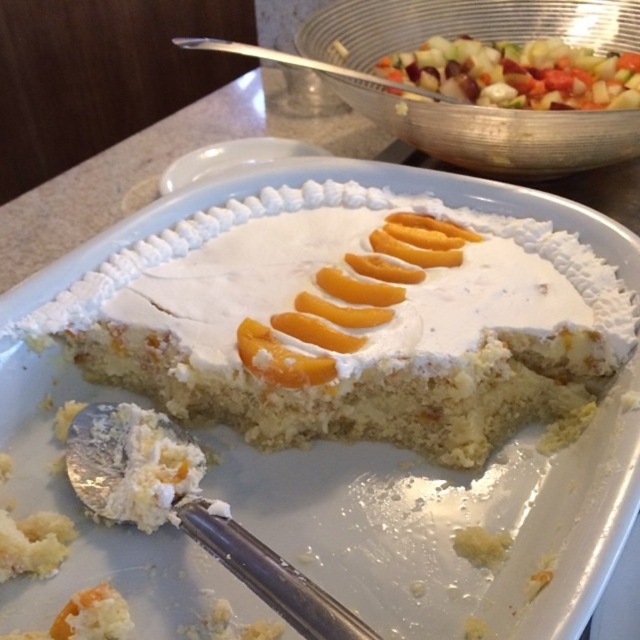
Between point (200, 333) and point (451, 49), which one is positioned behind?

Positioned behind is point (451, 49).

Who is positioned more to the left, white creamy frosting at center or multicolored diced vegetables at upper right?

→ white creamy frosting at center is more to the left.

Does point (198, 332) come in front of point (557, 60)?

That is True.

Identify the location of white creamy frosting at center. (241, 278).

Which is in front, point (467, 253) or point (436, 339)?

Point (436, 339)

Based on the photo, does white creamy cake at center have a larger size compared to white creamy frosting at center?

Correct, white creamy cake at center is larger in size than white creamy frosting at center.

At what (x,y) coordinates should I click in order to perform the action: click on white creamy cake at center. Please return your answer as a coordinate pair (x, y). This screenshot has width=640, height=640. Looking at the image, I should click on (372, 336).

Image resolution: width=640 pixels, height=640 pixels. Find the location of `white creamy cake at center`. white creamy cake at center is located at coordinates (372, 336).

Is white creamy cake at center further to camera compared to multicolored diced vegetables at upper right?

No, it is in front of multicolored diced vegetables at upper right.

Which of these two, white creamy cake at center or multicolored diced vegetables at upper right, stands taller?

white creamy cake at center is taller.

Does point (170, 230) come farther from viewer compared to point (481, 76)?

No, it is in front of (481, 76).

Locate an element on the screen. This screenshot has width=640, height=640. white creamy cake at center is located at coordinates (372, 336).